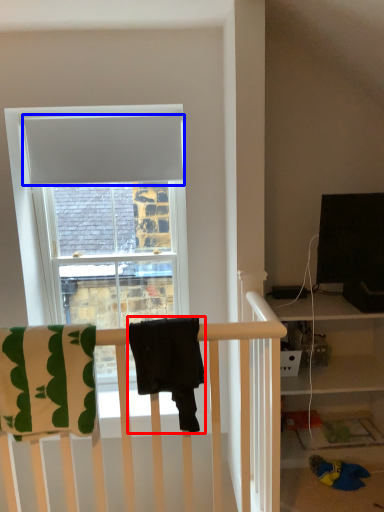
Question: Which object appears closest to the camera in this image, beach towel (highlighted by a red box) or curtain (highlighted by a blue box)?

Choices:
 (A) beach towel
 (B) curtain

Answer: (A)